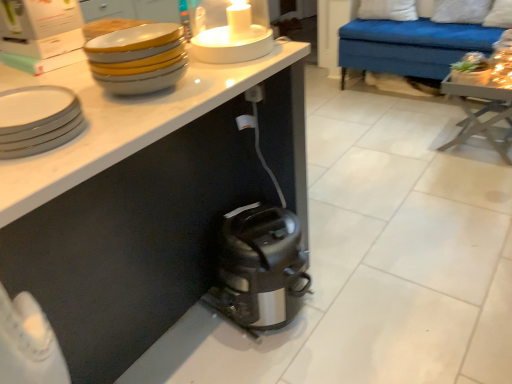
Question: Considering the relative positions of white soft pillow at upper right, placed as the 1th pillow when sorted from right to left, and white soft pillow at upper right, marked as the second pillow in a right-to-left arrangement, in the image provided, is white soft pillow at upper right, placed as the 1th pillow when sorted from right to left, to the left of white soft pillow at upper right, marked as the second pillow in a right-to-left arrangement, from the viewer's perspective?

Choices:
 (A) no
 (B) yes

Answer: (A)

Question: Does white soft pillow at upper right, which is the second pillow in left-to-right order, appear on the right side of white soft pillow at upper right, which is counted as the 1th pillow, starting from the left?

Choices:
 (A) no
 (B) yes

Answer: (B)

Question: Are white soft pillow at upper right, which is the second pillow in left-to-right order, and white soft pillow at upper right, which is counted as the 1th pillow, starting from the left, far apart?

Choices:
 (A) no
 (B) yes

Answer: (A)

Question: Is white soft pillow at upper right, which is the second pillow in left-to-right order, looking in the opposite direction of white soft pillow at upper right, marked as the second pillow in a right-to-left arrangement?

Choices:
 (A) yes
 (B) no

Answer: (B)

Question: From a real-world perspective, is white soft pillow at upper right, which is the second pillow in left-to-right order, positioned over white soft pillow at upper right, which is counted as the 1th pillow, starting from the left, based on gravity?

Choices:
 (A) no
 (B) yes

Answer: (B)

Question: Can you confirm if white soft pillow at upper right, placed as the 1th pillow when sorted from right to left, is thinner than white soft pillow at upper right, marked as the second pillow in a right-to-left arrangement?

Choices:
 (A) yes
 (B) no

Answer: (B)

Question: Considering the relative sizes of white glossy candle holder at upper center and wooden table at right in the image provided, is white glossy candle holder at upper center shorter than wooden table at right?

Choices:
 (A) no
 (B) yes

Answer: (B)

Question: Is white glossy candle holder at upper center taller than wooden table at right?

Choices:
 (A) no
 (B) yes

Answer: (A)

Question: Is white glossy candle holder at upper center oriented away from wooden table at right?

Choices:
 (A) yes
 (B) no

Answer: (B)

Question: Is white glossy candle holder at upper center with wooden table at right?

Choices:
 (A) yes
 (B) no

Answer: (B)

Question: Is white glossy candle holder at upper center bigger than wooden table at right?

Choices:
 (A) no
 (B) yes

Answer: (A)

Question: Are white glossy candle holder at upper center and wooden table at right located far from each other?

Choices:
 (A) no
 (B) yes

Answer: (B)

Question: Is satin silver toaster at lower center positioned in front of satin black toaster at lower center?

Choices:
 (A) no
 (B) yes

Answer: (A)